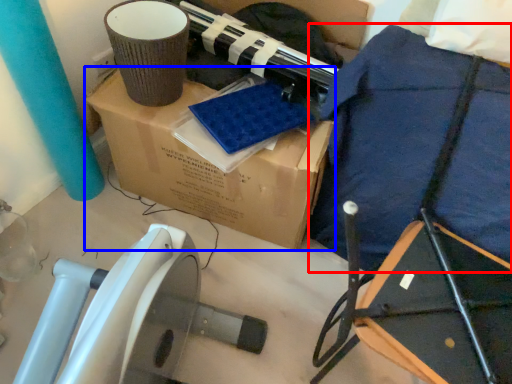
Question: Which of the following is the closest to the observer, blanket (highlighted by a red box) or box (highlighted by a blue box)?

Choices:
 (A) blanket
 (B) box

Answer: (A)